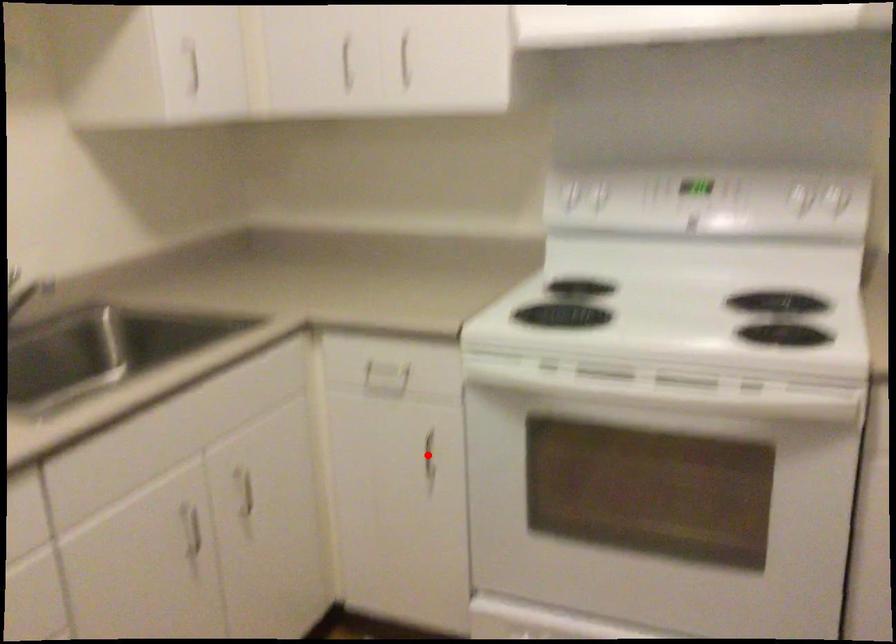
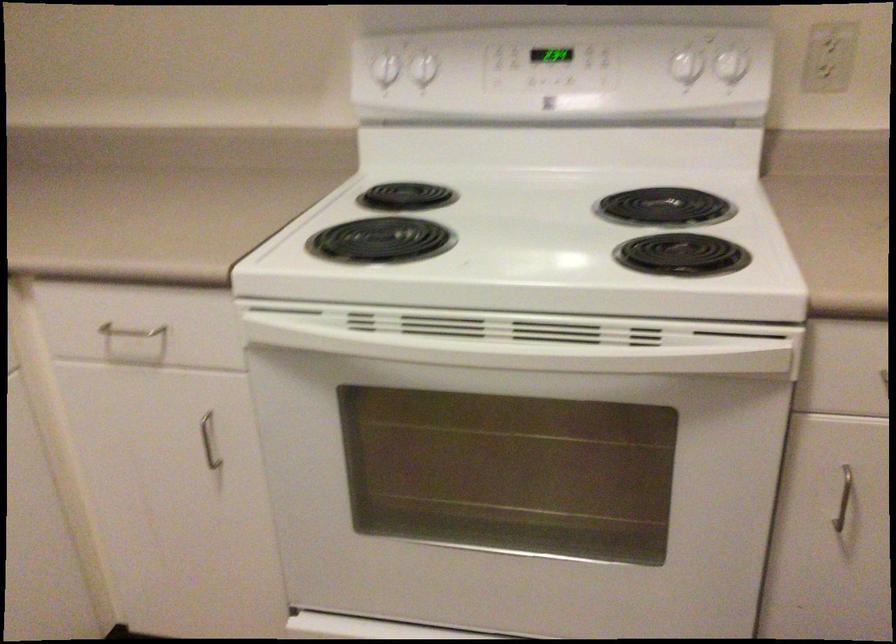
Question: I am providing you with two images of the same scene from different viewpoints. Given a red point in image1, look at the same physical point in image2. Is it:

Choices:
 (A) Closer to the viewpoint
 (B) Farther from the viewpoint

Answer: (A)